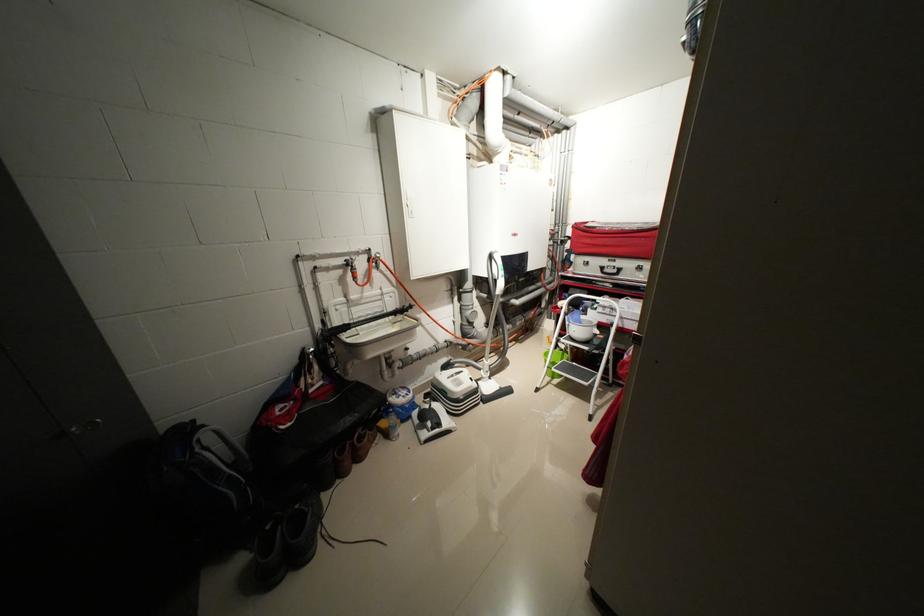
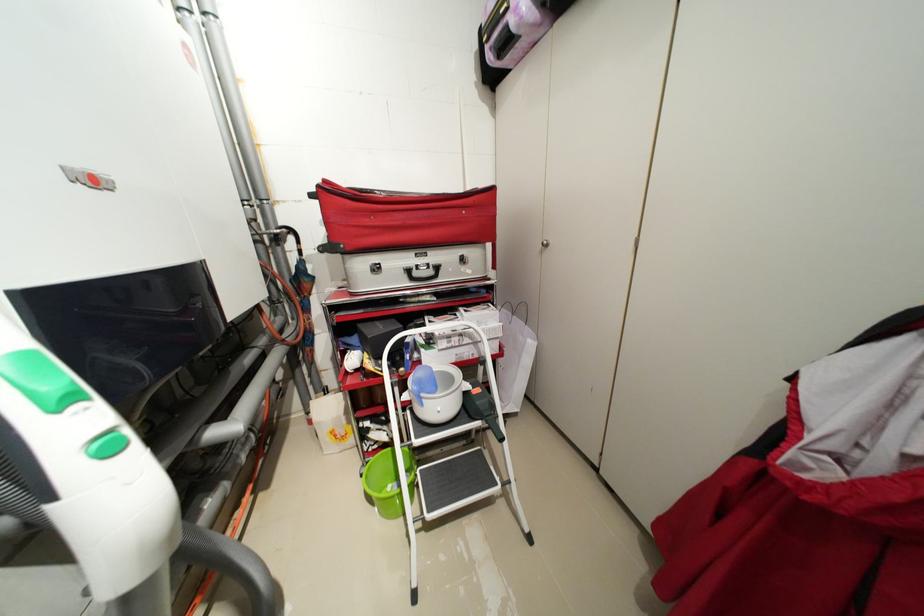
Find the pixel in the second image that matches point 613,270 in the first image.

(422, 275)